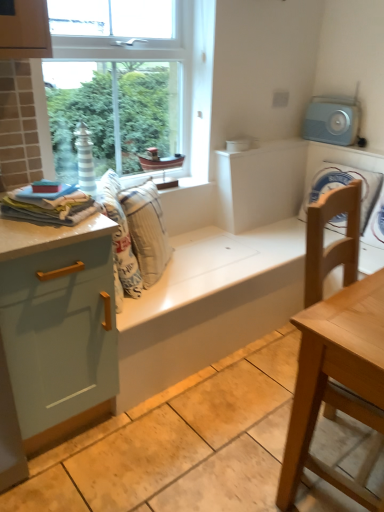
I want to click on vacant space in light wood table at right (from a real-world perspective), so click(x=328, y=452).